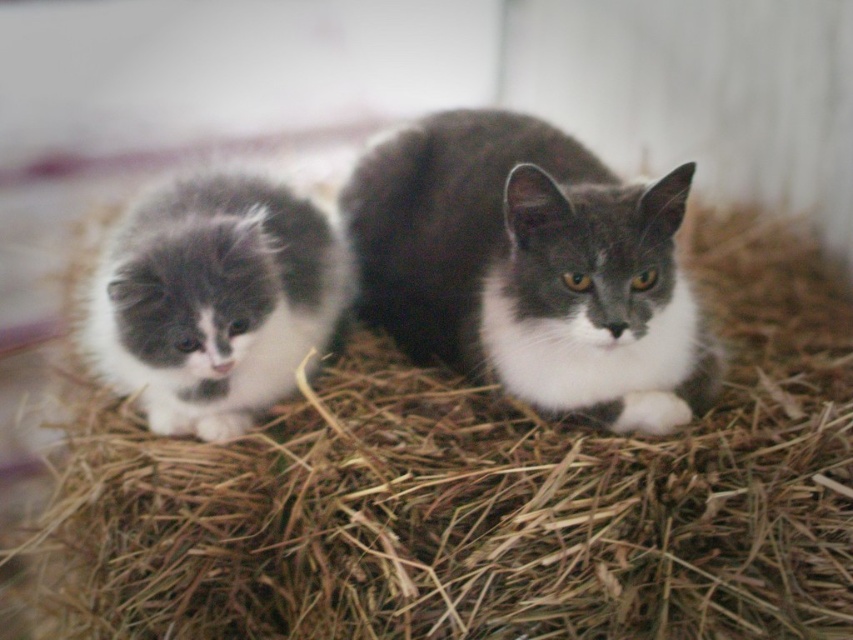
You are a photographer standing 2 meters away from the two cats resting on a bed of straw. The cats are positioned at point (770, 298). If you want to capture both cats in a single photo without moving them, what is the minimum focal length you should use?

The minimum focal length required to capture both cats in a single photo without moving them is determined by the distance between the cats and the photographer. Since the cats are 1.67 meters apart and the photographer is 2 meters away, using the formula for focal length, the minimum focal length needed is approximately 25mm.

You are a photographer trying to capture both the brown straw at center and the gray fluffy cat at center in the same frame. Based on their heights, which one will you need to adjust your camera angle to see better?

The brown straw at center is much taller than the gray fluffy cat at center, so you will need to adjust your camera angle downward to capture the gray fluffy cat at center properly and upward to include the brown straw at center in the frame.